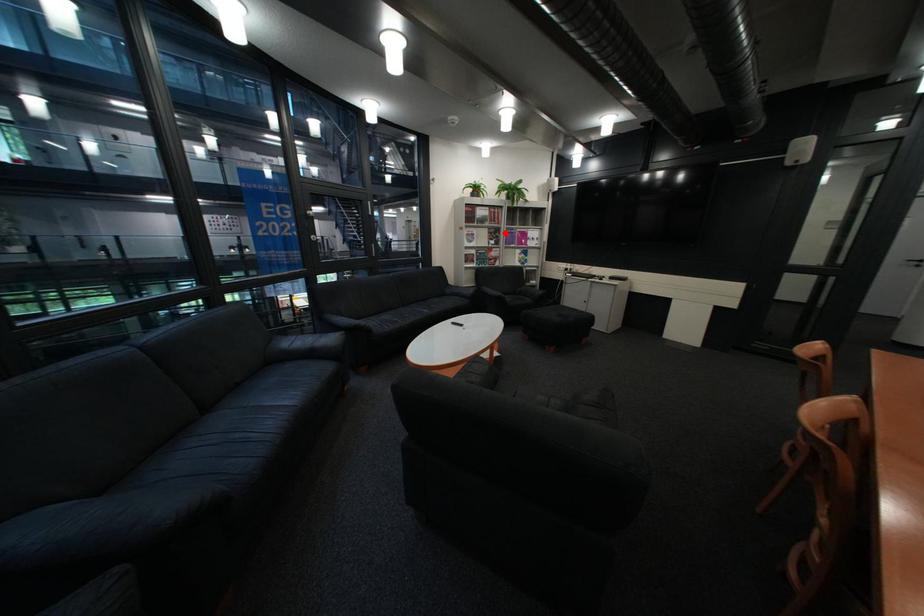
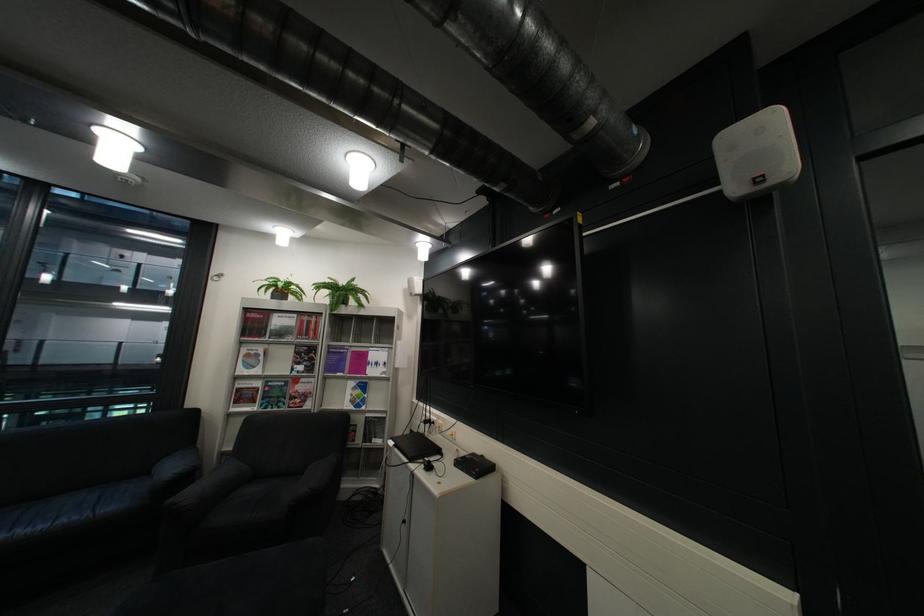
Question: I am providing you with two images of the same scene from different viewpoints. Image1 has a red point marked. In image2, the corresponding 3D location appears at what relative position? Reply with the corresponding letter.

Choices:
 (A) Closer
 (B) Farther

Answer: (B)